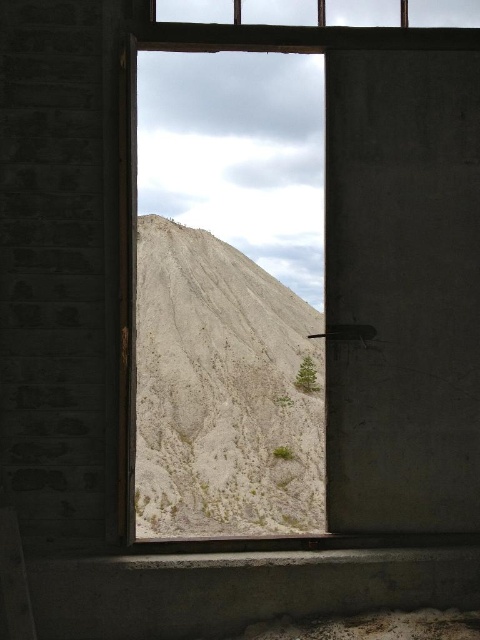
Does matte concrete window at center have a smaller size compared to white sandy hillside at center?

Correct, matte concrete window at center occupies less space than white sandy hillside at center.

Who is more forward, (335, 516) or (311, 403)?

Point (335, 516)

Describe the element at coordinates (365, 268) in the screenshot. The width and height of the screenshot is (480, 640). I see `matte concrete window at center` at that location.

Locate an element on the screen. This screenshot has width=480, height=640. matte concrete window at center is located at coordinates (365, 268).